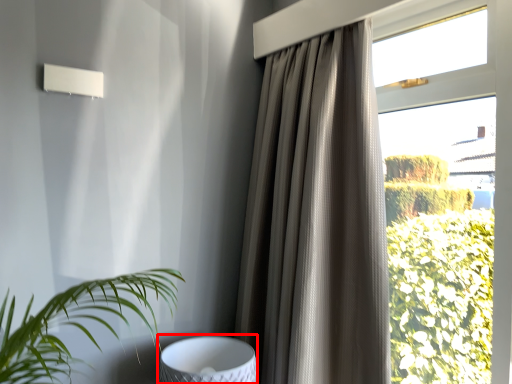
Question: Considering the relative positions of swivel chair (annotated by the red box) and curtain in the image provided, where is swivel chair (annotated by the red box) located with respect to the staircase?

Choices:
 (A) right
 (B) left

Answer: (B)